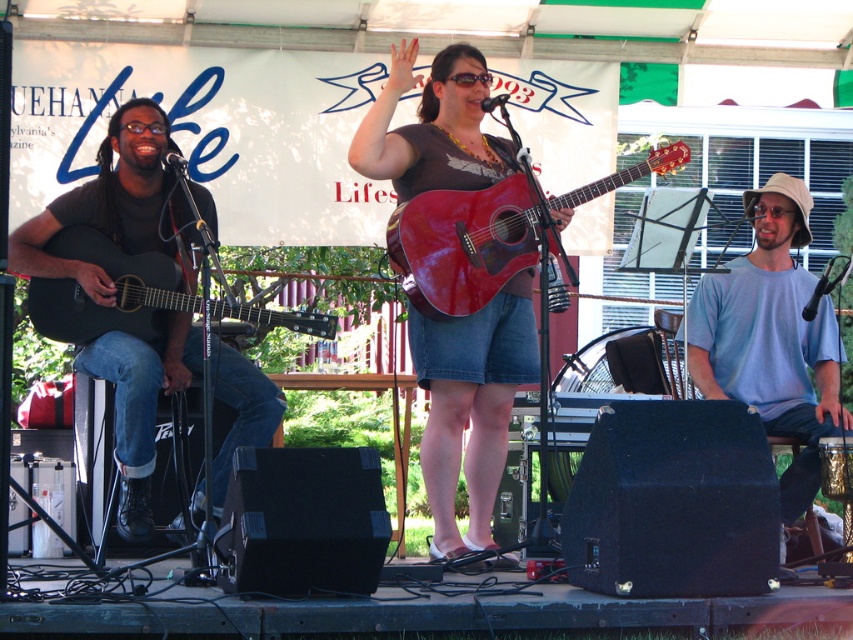
Who is positioned more to the left, matte black guitar at left or matte black acoustic guitar at left?

matte black guitar at left

You are a GUI agent. You are given a task and a screenshot of the screen. Output one action in this format:
    pyautogui.click(x=<x>, y=<y>)
    Task: Click on the matte black guitar at left
    
    Given the screenshot: What is the action you would take?
    pyautogui.click(x=112, y=204)

At what (x,y) coordinates should I click in order to perform the action: click on matte black guitar at left. Please return your answer as a coordinate pair (x, y). The image size is (853, 640). Looking at the image, I should click on (112, 204).

Who is positioned more to the right, glossy wood guitar at center or matte black acoustic guitar at left?

Positioned to the right is glossy wood guitar at center.

Between point (456, 205) and point (88, 337), which one is positioned in front?

Point (88, 337) is in front.

Between point (430, 276) and point (140, 321), which one is positioned in front?

Positioned in front is point (430, 276).

You are a GUI agent. You are given a task and a screenshot of the screen. Output one action in this format:
    pyautogui.click(x=<x>, y=<y>)
    Task: Click on the glossy wood guitar at center
    
    Given the screenshot: What is the action you would take?
    pyautogui.click(x=463, y=244)

Who is shorter, shiny red guitar at center or matte black acoustic guitar at left?

matte black acoustic guitar at left is shorter.

Is shiny red guitar at center taller than matte black acoustic guitar at left?

Correct, shiny red guitar at center is much taller as matte black acoustic guitar at left.

The image size is (853, 640). I want to click on shiny red guitar at center, so click(471, 406).

What are the coordinates of `shiny red guitar at center` in the screenshot? It's located at (471, 406).